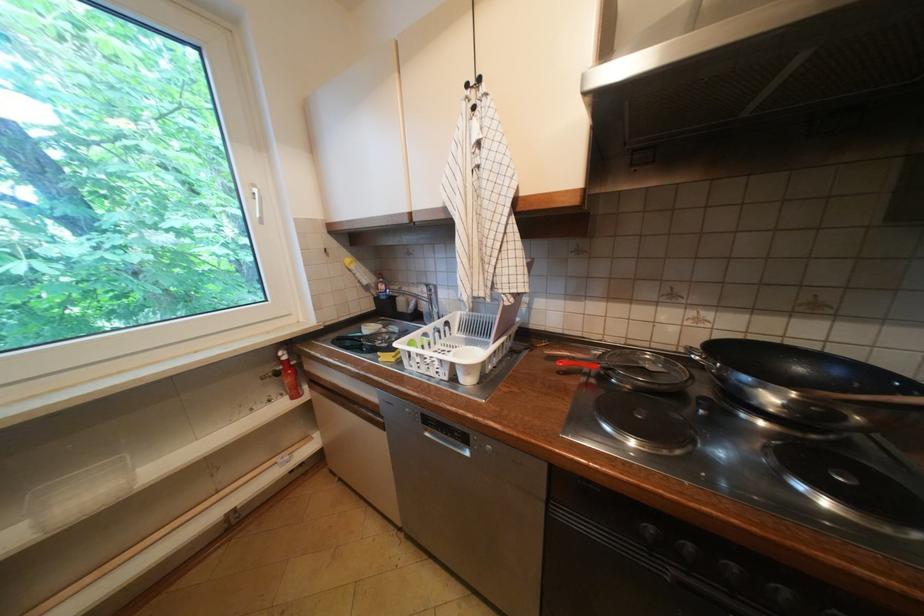
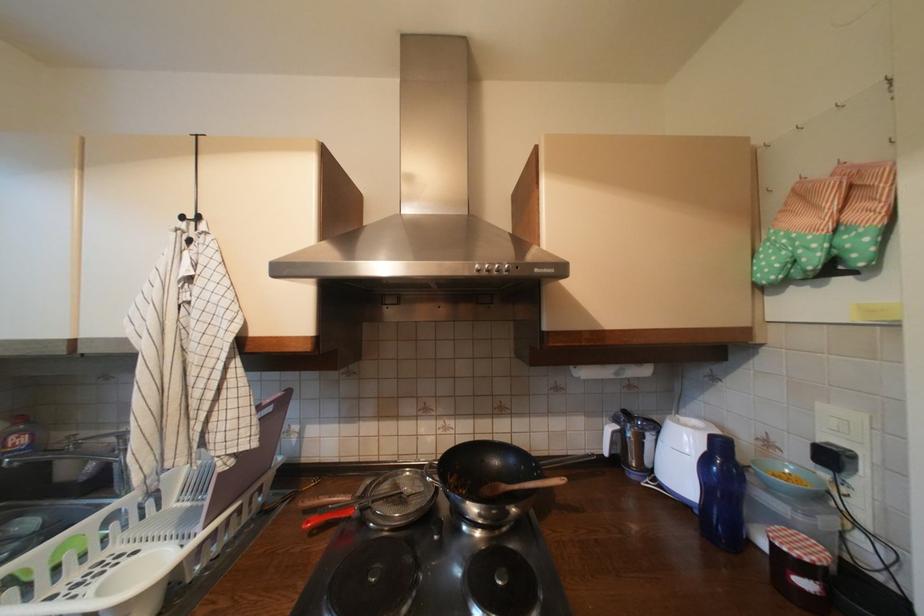
Question: I am providing you with two images of the same scene from different viewpoints. After the viewpoint changes to image2, which objects are now occluded?

Choices:
 (A) small jar lid
 (B) strainer handle
 (C) extractor hood button
 (D) none of these

Answer: (D)